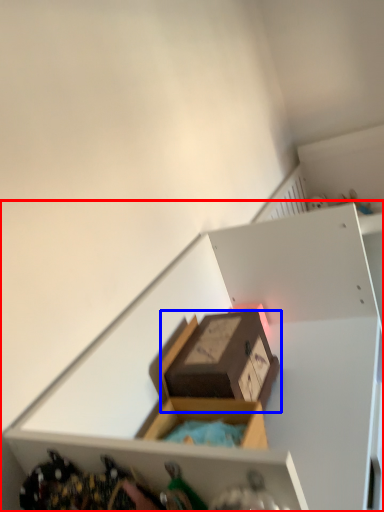
Question: Which of the following is the closest to the observer, shelf (highlighted by a red box) or box (highlighted by a blue box)?

Choices:
 (A) shelf
 (B) box

Answer: (A)